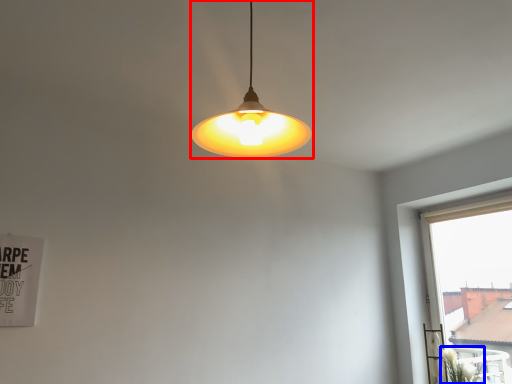
Question: Which of the following is the closest to the observer, lamp (highlighted by a red box) or plant (highlighted by a blue box)?

Choices:
 (A) lamp
 (B) plant

Answer: (A)